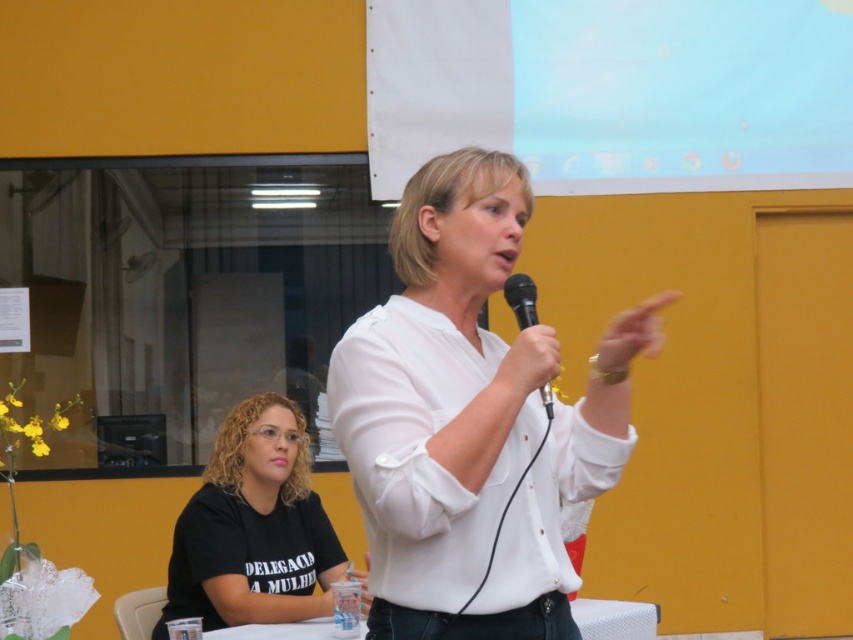
Is white matte shirt at center below white plastic table at lower center?

Incorrect, white matte shirt at center is not positioned below white plastic table at lower center.

In order to click on white matte shirt at center in this screenshot , I will do `click(471, 419)`.

Between black matte shirt at lower left and white plastic table at lower center, which one has more height?

black matte shirt at lower left

Is point (258, 496) closer to viewer compared to point (585, 625)?

No, it is behind (585, 625).

Image resolution: width=853 pixels, height=640 pixels. I want to click on black matte shirt at lower left, so click(254, 529).

How far apart are black matte shirt at lower left and black matte microphone at center?

black matte shirt at lower left is 5.19 feet from black matte microphone at center.

Can you confirm if black matte shirt at lower left is bigger than black matte microphone at center?

Yes.

Is point (297, 499) behind point (537, 316)?

Yes, it is.

In order to click on black matte shirt at lower left in this screenshot , I will do `click(254, 529)`.